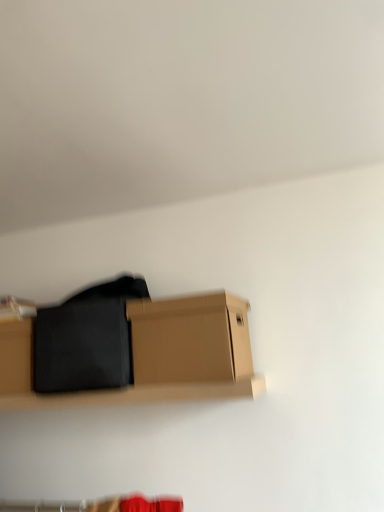
Question: Does brown cardboard box at lower center have a lesser width compared to black matte fabric at center?

Choices:
 (A) no
 (B) yes

Answer: (B)

Question: Does brown cardboard box at lower center appear on the left side of black matte fabric at center?

Choices:
 (A) no
 (B) yes

Answer: (A)

Question: From the image's perspective, is brown cardboard box at lower center beneath black matte fabric at center?

Choices:
 (A) no
 (B) yes

Answer: (A)

Question: Considering the relative positions of brown cardboard box at lower center and black matte fabric at center in the image provided, is brown cardboard box at lower center to the right of black matte fabric at center from the viewer's perspective?

Choices:
 (A) yes
 (B) no

Answer: (A)

Question: Is black matte fabric at center at the back of brown cardboard box at lower center?

Choices:
 (A) yes
 (B) no

Answer: (B)

Question: Is brown cardboard box at lower center taller than black matte fabric at center?

Choices:
 (A) no
 (B) yes

Answer: (A)

Question: Considering the relative positions of black matte fabric at center and brown cardboard box at lower center in the image provided, is black matte fabric at center to the left of brown cardboard box at lower center from the viewer's perspective?

Choices:
 (A) no
 (B) yes

Answer: (B)

Question: Is black matte fabric at center facing away from brown cardboard box at lower center?

Choices:
 (A) yes
 (B) no

Answer: (B)

Question: Is black matte fabric at center in contact with brown cardboard box at lower center?

Choices:
 (A) yes
 (B) no

Answer: (B)

Question: Is black matte fabric at center further to the viewer compared to brown cardboard box at lower center?

Choices:
 (A) no
 (B) yes

Answer: (B)

Question: Is black matte fabric at center to the right of brown cardboard box at lower center from the viewer's perspective?

Choices:
 (A) no
 (B) yes

Answer: (A)

Question: Is black matte fabric at center oriented towards brown cardboard box at lower center?

Choices:
 (A) no
 (B) yes

Answer: (A)

Question: Considering the relative positions of brown cardboard box at lower center and black matte fabric at center in the image provided, is brown cardboard box at lower center to the left or to the right of black matte fabric at center?

Choices:
 (A) right
 (B) left

Answer: (A)